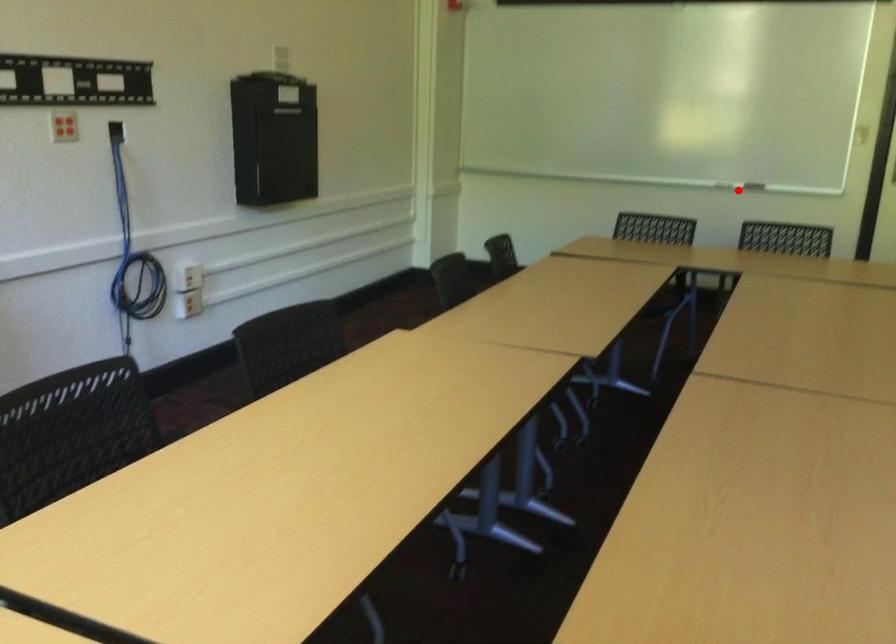
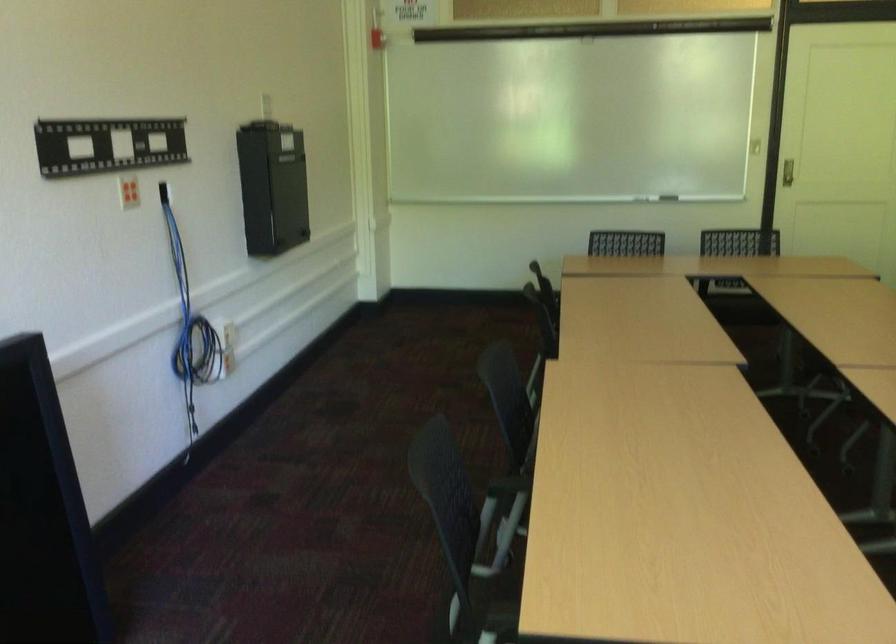
Locate, in the second image, the point that corresponds to the highlighted location in the first image.

(668, 198)